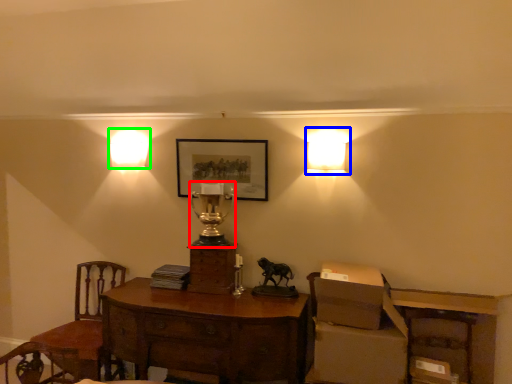
Question: Based on their relative distances, which object is nearer to table lamp (highlighted by a red box)? Choose from lamp (highlighted by a blue box) and lamp (highlighted by a green box).

Choices:
 (A) lamp
 (B) lamp

Answer: (B)